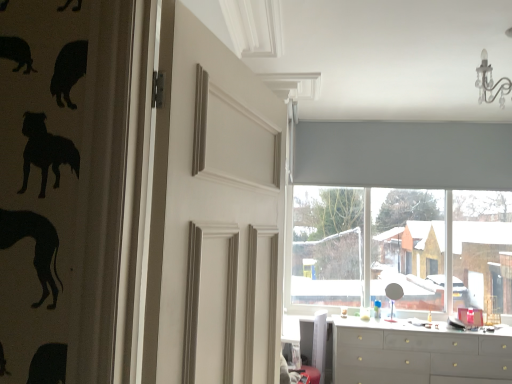
What do you see at coordinates (403, 155) in the screenshot? I see `gray fabric curtain at upper center` at bounding box center [403, 155].

What is the approximate width of matte gray roller blind at upper center?

matte gray roller blind at upper center is 6.20 inches in width.

Image resolution: width=512 pixels, height=384 pixels. I want to click on white matte door at center, so click(x=212, y=214).

Where is `gray fabric curtain at upper center`? gray fabric curtain at upper center is located at coordinates [403, 155].

Which object is thinner, gray fabric curtain at upper center or white glossy counter top at lower center?

gray fabric curtain at upper center is thinner.

Is gray fabric curtain at upper center far from white glossy counter top at lower center?

Absolutely, gray fabric curtain at upper center is distant from white glossy counter top at lower center.

In the scene shown: Is gray fabric curtain at upper center bigger or smaller than white glossy counter top at lower center?

Considering their sizes, gray fabric curtain at upper center takes up more space than white glossy counter top at lower center.

Locate an element on the screen. This screenshot has width=512, height=384. chest of drawers below the white glossy counter top at lower center (from the image's perspective) is located at coordinates (419, 356).

Between white glossy counter top at lower center and matte gray dresser at lower right, which one is positioned in front?

matte gray dresser at lower right.

What's the angular difference between white glossy counter top at lower center and matte gray dresser at lower right's facing directions?

0.216 degrees.

From a real-world perspective, which object stands above the other?

In real-world perspective, matte gray roller blind at upper center is above.

Is point (434, 178) closer or farther from the camera than point (390, 324)?

Clearly, point (434, 178) is more distant from the camera than point (390, 324).

Is white glossy counter top at lower center located within matte gray roller blind at upper center?

No, matte gray roller blind at upper center does not contain white glossy counter top at lower center.

Is matte gray roller blind at upper center oriented towards white glossy counter top at lower center?

No, matte gray roller blind at upper center is not oriented towards white glossy counter top at lower center.

Does white matte door at center have a greater width compared to matte gray roller blind at upper center?

Yes, white matte door at center is wider than matte gray roller blind at upper center.

Considering the relative positions of white matte door at center and matte gray roller blind at upper center in the image provided, is white matte door at center to the right of matte gray roller blind at upper center from the viewer's perspective?

No, white matte door at center is not to the right of matte gray roller blind at upper center.

Considering the sizes of objects white matte door at center and matte gray roller blind at upper center in the image provided, who is shorter, white matte door at center or matte gray roller blind at upper center?

white matte door at center is shorter.

Is white matte door at center inside the boundaries of matte gray roller blind at upper center, or outside?

white matte door at center is located beyond the bounds of matte gray roller blind at upper center.

Is gray fabric curtain at upper center taller or shorter than matte gray roller blind at upper center?

In the image, gray fabric curtain at upper center appears to be shorter than matte gray roller blind at upper center.

Between gray fabric curtain at upper center and matte gray roller blind at upper center, which one has larger size?

matte gray roller blind at upper center is bigger.

Could you tell me if gray fabric curtain at upper center is facing matte gray roller blind at upper center?

No, gray fabric curtain at upper center is not turned towards matte gray roller blind at upper center.

Is matte gray dresser at lower right facing towards white glossy counter top at lower center?

No, matte gray dresser at lower right is not aimed at white glossy counter top at lower center.

Could white glossy counter top at lower center be considered to be inside matte gray dresser at lower right?

No.

Between matte gray dresser at lower right and white glossy counter top at lower center, which one appears on the right side from the viewer's perspective?

Positioned to the right is matte gray dresser at lower right.

In the scene shown: From the image's perspective, between matte gray dresser at lower right and white glossy counter top at lower center, who is located below?

matte gray dresser at lower right.

Is white glossy counter top at lower center at the right side of gray fabric curtain at upper center?

No.

From the image's perspective, is white glossy counter top at lower center under gray fabric curtain at upper center?

Correct, white glossy counter top at lower center appears lower than gray fabric curtain at upper center in the image.

Is white glossy counter top at lower center positioned in front of gray fabric curtain at upper center?

Yes, white glossy counter top at lower center is closer to the viewer.

Is white glossy counter top at lower center wider than gray fabric curtain at upper center?

Yes.

The height and width of the screenshot is (384, 512). Identify the location of curtain that is on the right side of white glossy counter top at lower center. (403, 155).

This screenshot has height=384, width=512. I want to click on counter top above the matte gray dresser at lower right (from the image's perspective), so click(x=391, y=323).

From the image, which object appears to be farther from gray fabric curtain at upper center, matte gray roller blind at upper center or white matte door at center?

white matte door at center is further to gray fabric curtain at upper center.

Considering their positions, is white matte door at center positioned closer to gray fabric curtain at upper center than matte gray dresser at lower right?

matte gray dresser at lower right lies closer to gray fabric curtain at upper center than the other object.

Which object lies nearer to the anchor point white matte door at center, gray fabric curtain at upper center or matte gray dresser at lower right?

matte gray dresser at lower right.

Based on their spatial positions, is white matte door at center or matte gray dresser at lower right further from matte gray roller blind at upper center?

white matte door at center lies further to matte gray roller blind at upper center than the other object.

Considering their positions, is matte gray dresser at lower right positioned further to matte gray roller blind at upper center than gray fabric curtain at upper center?

matte gray dresser at lower right is further to matte gray roller blind at upper center.

When comparing their distances from white glossy counter top at lower center, does white matte door at center or matte gray dresser at lower right seem further?

Based on the image, white matte door at center appears to be further to white glossy counter top at lower center.

Considering their positions, is gray fabric curtain at upper center positioned closer to matte gray dresser at lower right than white glossy counter top at lower center?

white glossy counter top at lower center lies closer to matte gray dresser at lower right than the other object.

Which object lies further to the anchor point matte gray dresser at lower right, matte gray roller blind at upper center or gray fabric curtain at upper center?

gray fabric curtain at upper center.

The height and width of the screenshot is (384, 512). I want to click on chest of drawers between white matte door at center and white glossy counter top at lower center in the front-back direction, so click(x=419, y=356).

I want to click on window between gray fabric curtain at upper center and matte gray dresser at lower right in the vertical direction, so click(403, 154).

This screenshot has width=512, height=384. Identify the location of counter top between gray fabric curtain at upper center and matte gray dresser at lower right in the up-down direction. (391, 323).

Where is `window positioned between white matte door at center and gray fabric curtain at upper center from near to far`? window positioned between white matte door at center and gray fabric curtain at upper center from near to far is located at coordinates (403, 154).